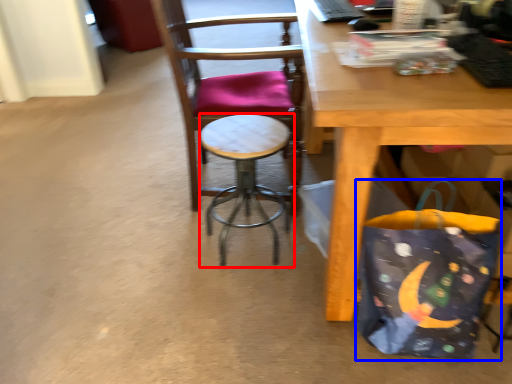
Question: Which object appears closest to the camera in this image, stool (highlighted by a red box) or grocery bag (highlighted by a blue box)?

Choices:
 (A) stool
 (B) grocery bag

Answer: (B)